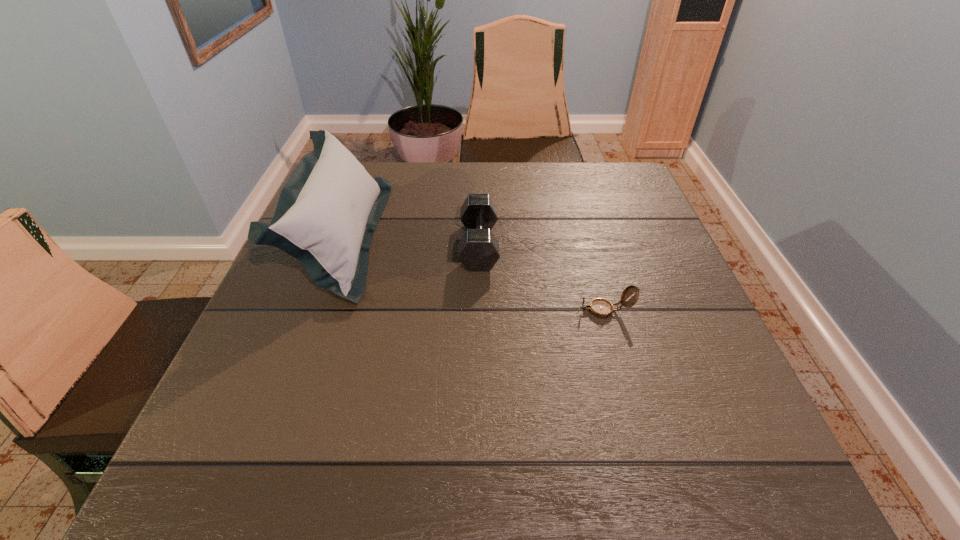
This screenshot has height=540, width=960. I want to click on object that is the closest to the second tallest object, so click(x=601, y=308).

Identify the location of free space that satisfies the following two spatial constraints: 1. on the surface of the second object from left to right; 2. on the right side of the tallest object. The width and height of the screenshot is (960, 540). (338, 245).

Identify the location of free spot that satisfies the following two spatial constraints: 1. on the surface of the tallest object; 2. on the left side of the second shortest object. (338, 245).

What are the coordinates of `vacant position in the image that satisfies the following two spatial constraints: 1. on the surface of the cushion; 2. on the right side of the dumbbell` in the screenshot? It's located at (338, 245).

At what (x,y) coordinates should I click in order to perform the action: click on free spot that satisfies the following two spatial constraints: 1. on the back side of the second object from left to right; 2. on the surface of the cushion. Please return your answer as a coordinate pair (x, y). Looking at the image, I should click on (479, 237).